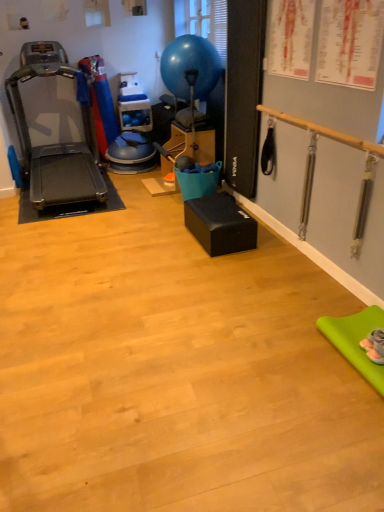
Question: Is blue rubber balloon at upper center facing towards metallic gray treadmill at left?

Choices:
 (A) yes
 (B) no

Answer: (A)

Question: Is blue rubber balloon at upper center closer to the viewer compared to metallic gray treadmill at left?

Choices:
 (A) no
 (B) yes

Answer: (A)

Question: Does blue rubber balloon at upper center have a lesser width compared to metallic gray treadmill at left?

Choices:
 (A) no
 (B) yes

Answer: (B)

Question: Can you confirm if blue rubber balloon at upper center is shorter than metallic gray treadmill at left?

Choices:
 (A) no
 (B) yes

Answer: (B)

Question: Is blue rubber balloon at upper center at the right side of metallic gray treadmill at left?

Choices:
 (A) yes
 (B) no

Answer: (A)

Question: From a real-world perspective, is blue rubber balloon at upper center below metallic gray treadmill at left?

Choices:
 (A) no
 (B) yes

Answer: (A)

Question: Is blue rubber balloon at upper center located within metallic gray treadmill at left?

Choices:
 (A) yes
 (B) no

Answer: (B)

Question: Does metallic gray treadmill at left have a smaller size compared to blue rubber balloon at upper center?

Choices:
 (A) no
 (B) yes

Answer: (A)

Question: Is metallic gray treadmill at left aimed at blue rubber balloon at upper center?

Choices:
 (A) no
 (B) yes

Answer: (A)

Question: Can you confirm if metallic gray treadmill at left is bigger than blue rubber balloon at upper center?

Choices:
 (A) no
 (B) yes

Answer: (B)

Question: From a real-world perspective, is metallic gray treadmill at left positioned over blue rubber balloon at upper center based on gravity?

Choices:
 (A) no
 (B) yes

Answer: (A)

Question: From a real-world perspective, does metallic gray treadmill at left sit lower than blue rubber balloon at upper center?

Choices:
 (A) no
 (B) yes

Answer: (B)

Question: Do you think blue rubber balloon at upper center is within metallic gray treadmill at left, or outside of it?

Choices:
 (A) outside
 (B) inside

Answer: (A)